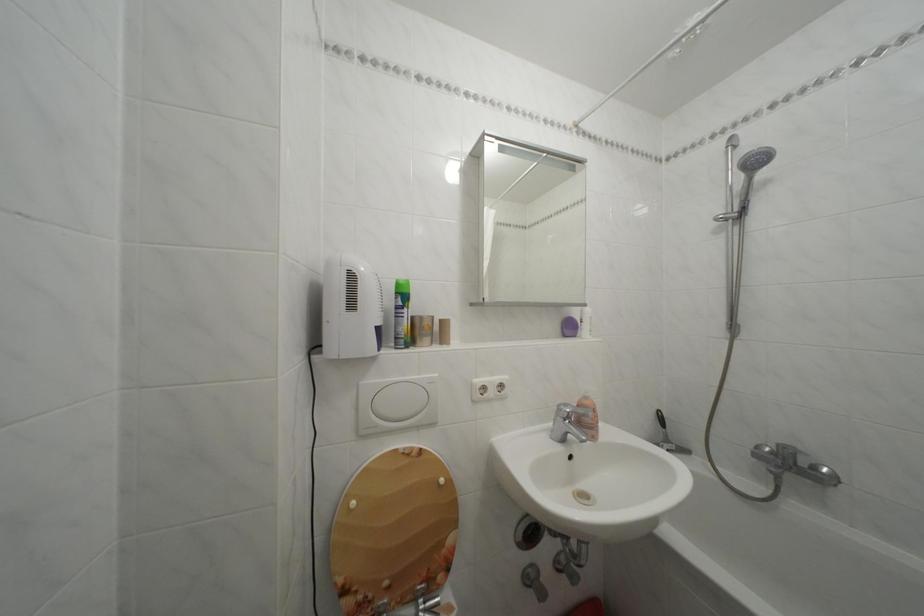
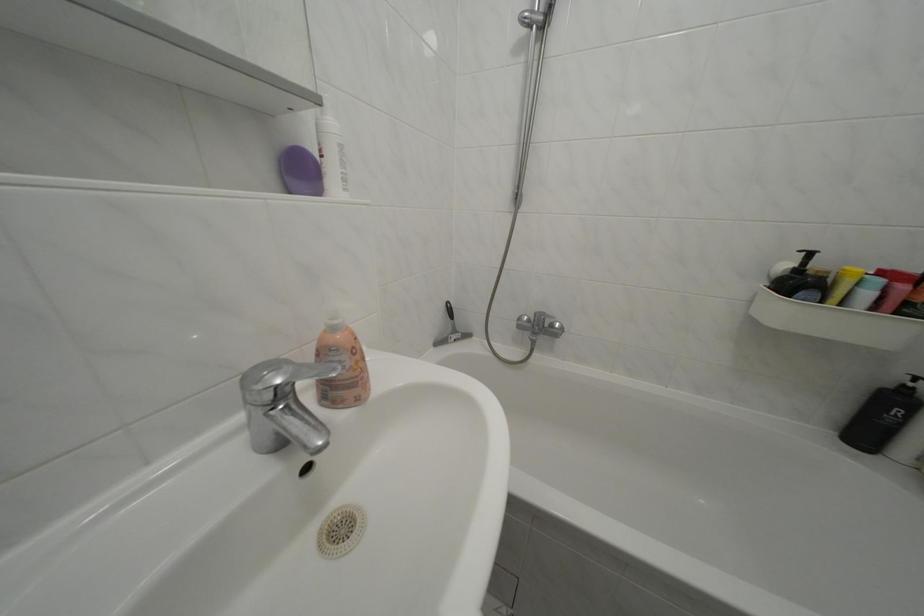
The point at (567, 411) is marked in the first image. Where is the corresponding point in the second image?

(252, 384)